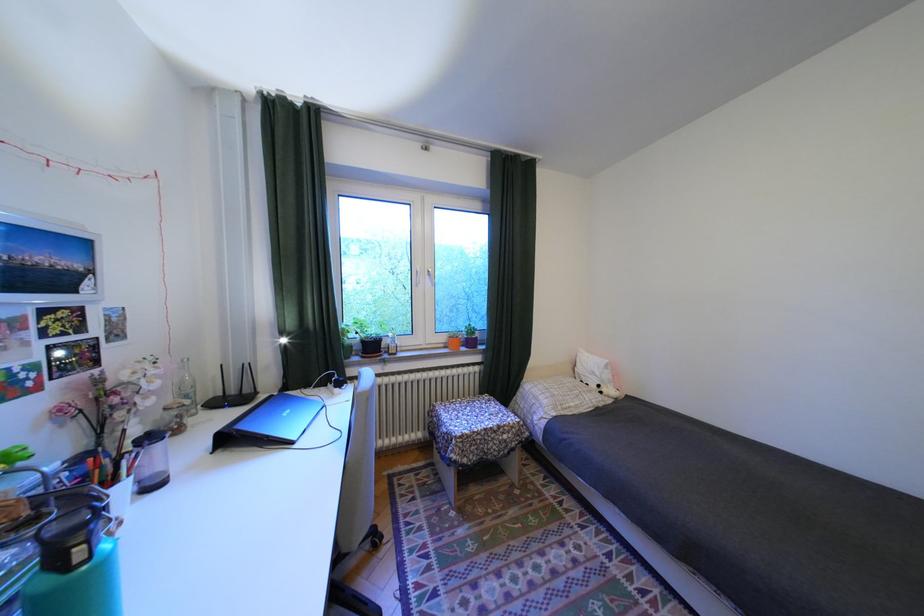
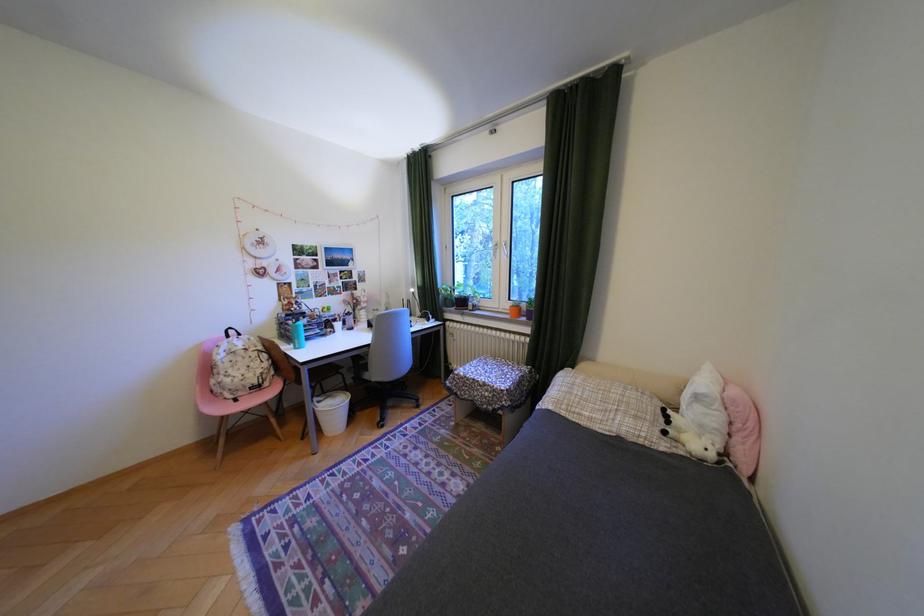
Where in the second image is the point corresponding to point 617,371 from the first image?

(710, 408)